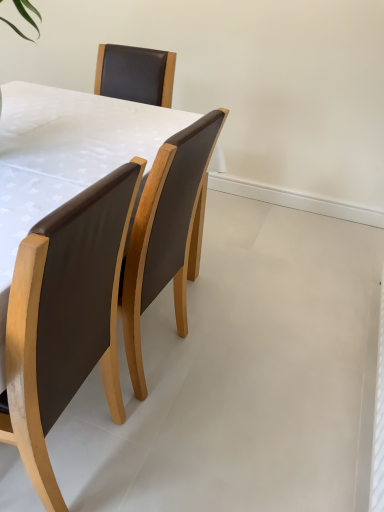
Where is `free spot to the right of brown leather table at center`? This screenshot has height=512, width=384. free spot to the right of brown leather table at center is located at coordinates (236, 360).